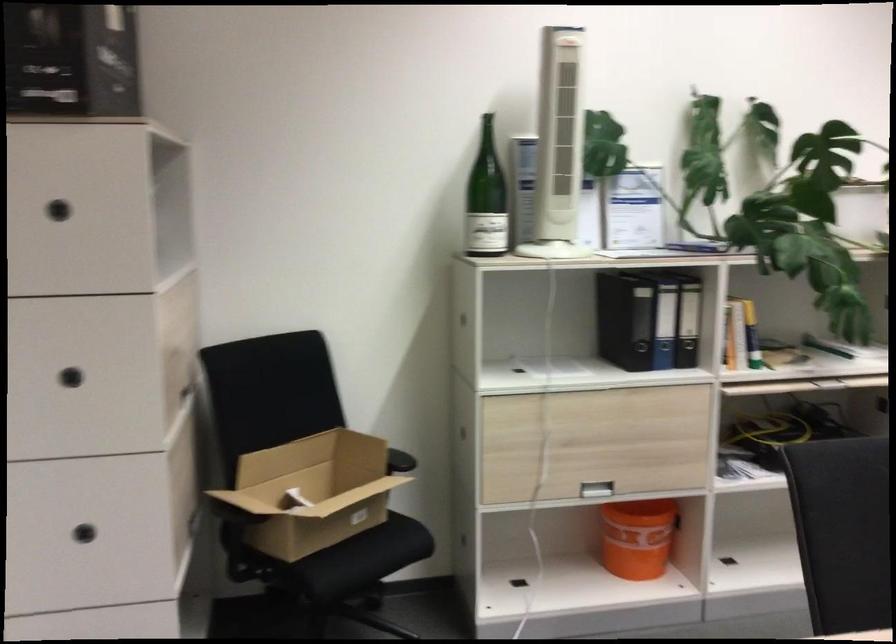
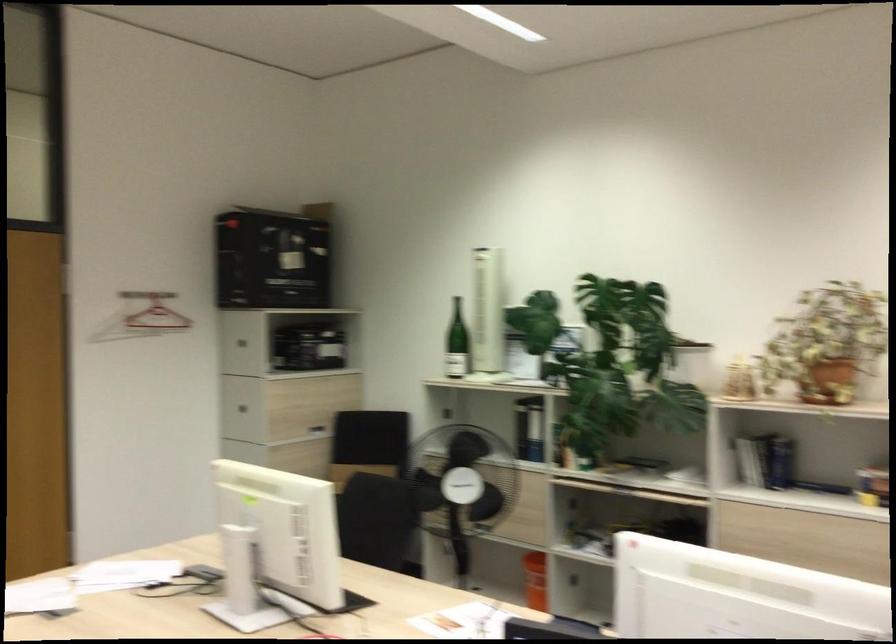
Where in the second image is the point corresponding to [657,545] from the first image?

(535, 580)